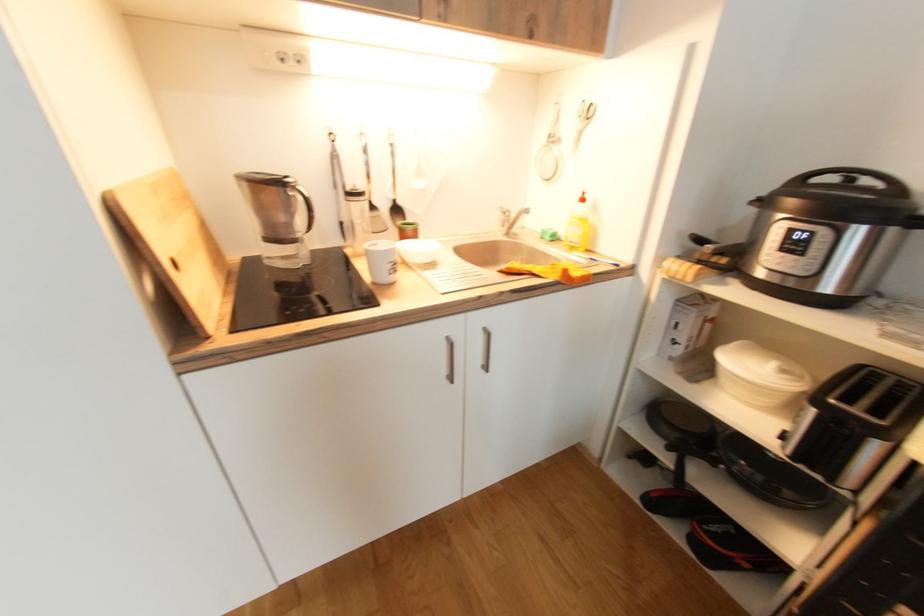
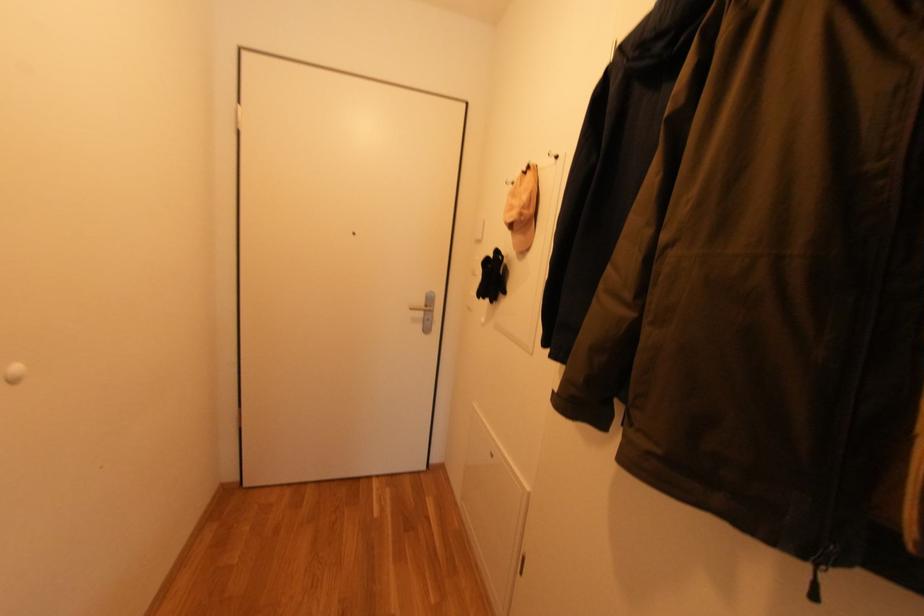
From the picture: Which direction would the cameraman need to move to produce the second image?

The movement direction of the cameraman is left, forward.